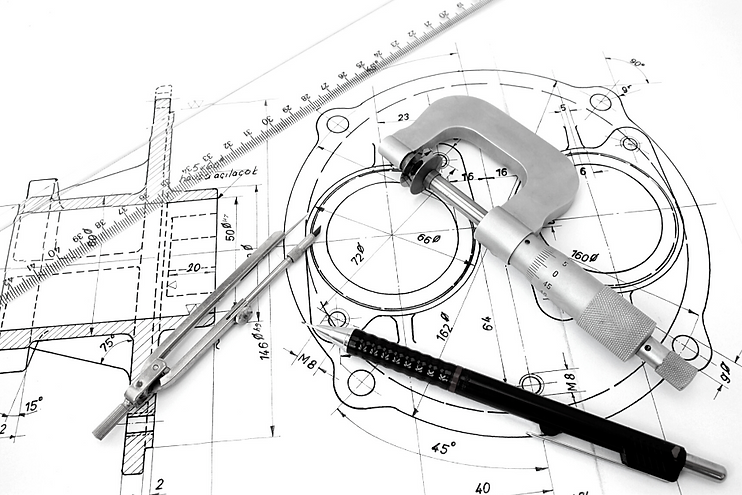
This screenshot has height=495, width=742. Find the location of `pen`. pen is located at coordinates (633, 442).